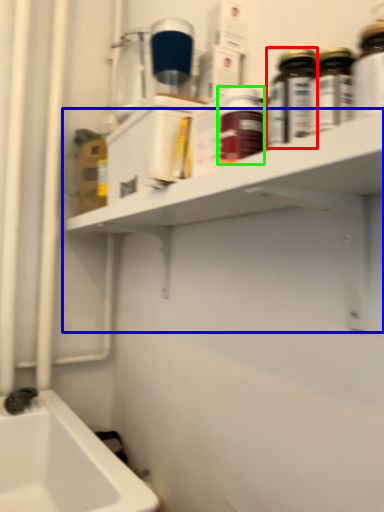
Question: Considering the real-world distances, which object is farthest from bottle (highlighted by a red box)? shelf (highlighted by a blue box) or bottle (highlighted by a green box)?

Choices:
 (A) shelf
 (B) bottle

Answer: (A)